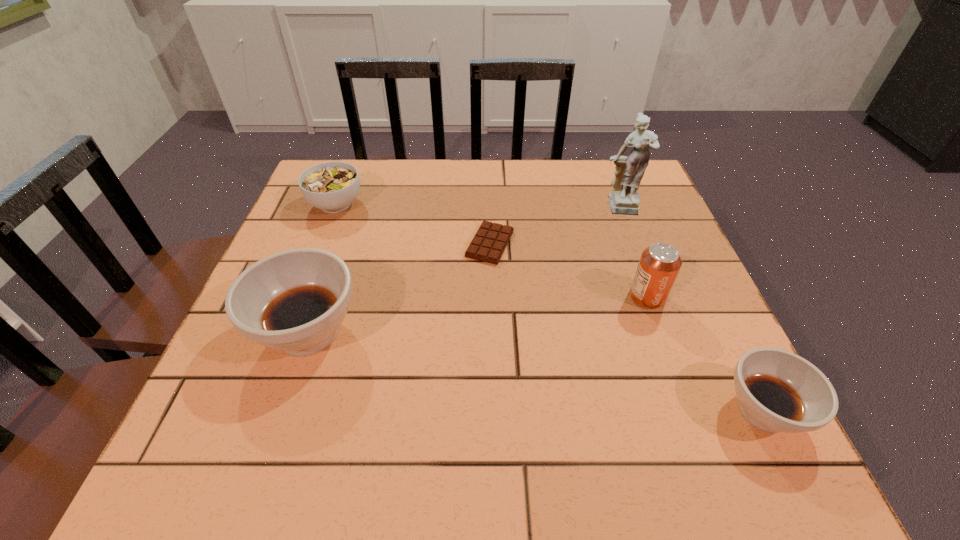
This screenshot has height=540, width=960. What are the coordinates of `the tallest soup bowl` in the screenshot? It's located at (294, 301).

In order to click on the rightmost soup bowl in this screenshot , I will do `click(778, 391)`.

The width and height of the screenshot is (960, 540). Find the location of `figurine`. figurine is located at coordinates (624, 199).

The height and width of the screenshot is (540, 960). Find the location of `the shortest object`. the shortest object is located at coordinates coord(488,245).

Find the location of a particular element. candy bar is located at coordinates (488, 245).

Identify the location of the farthest soup bowl. The height and width of the screenshot is (540, 960). (331, 186).

Find the location of a particular element. The image size is (960, 540). can is located at coordinates (658, 267).

At what (x,y) coordinates should I click in order to perform the action: click on vacant space situated on the right of the tallest soup bowl. Please return your answer as a coordinate pair (x, y). The width and height of the screenshot is (960, 540). Looking at the image, I should click on (471, 332).

Image resolution: width=960 pixels, height=540 pixels. In order to click on free spot located on the back of the rightmost soup bowl in this screenshot , I will do `click(733, 352)`.

Locate an element on the screen. This screenshot has width=960, height=540. vacant space located 0.140m on the front-facing side of the tallest object is located at coordinates (638, 260).